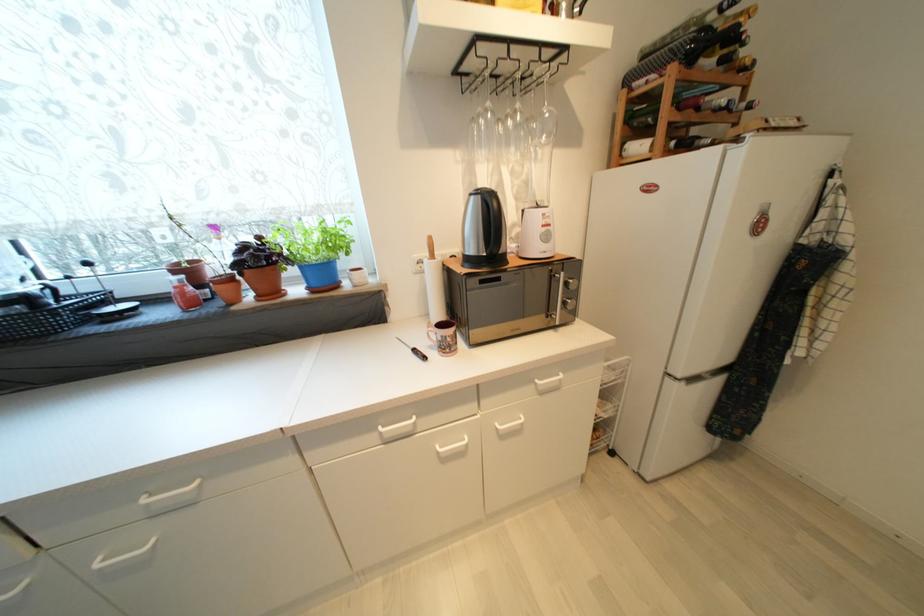
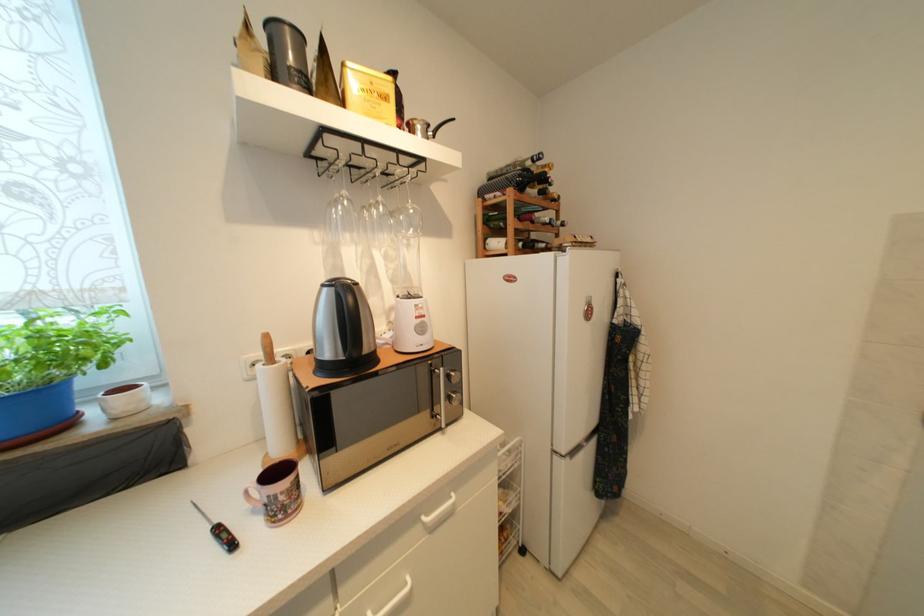
Where in the second image is the point corresponding to point (430, 360) from the first image?

(237, 546)